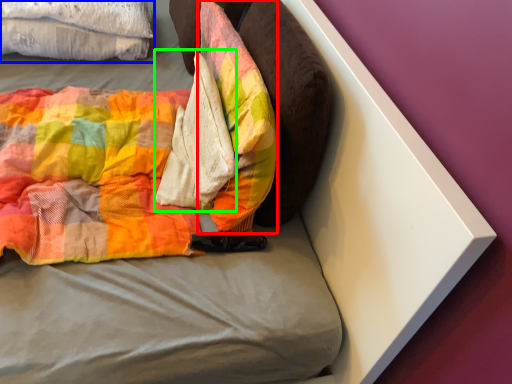
Question: Which is nearer to the pillow (highlighted by a red box)? cloth (highlighted by a blue box) or material (highlighted by a green box).

Choices:
 (A) cloth
 (B) material

Answer: (B)